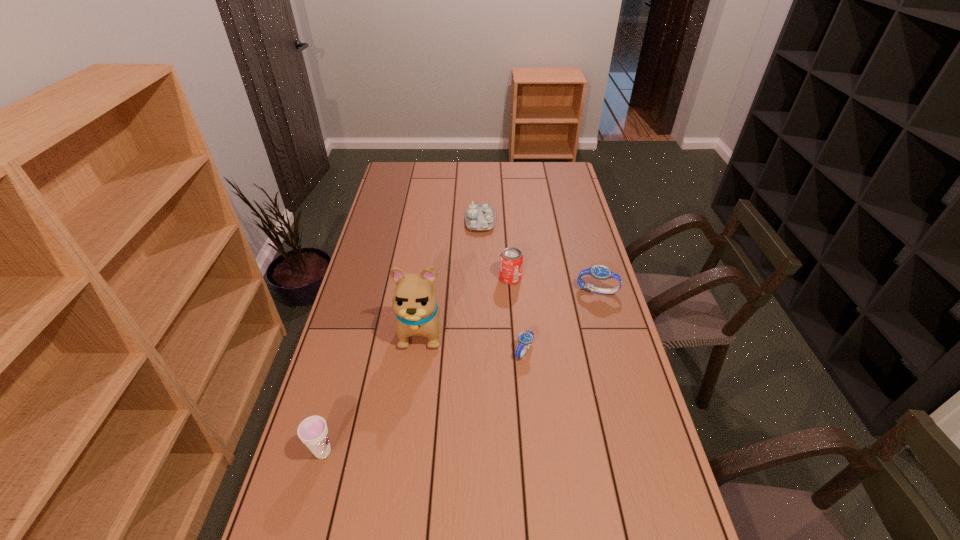
All watchs are currently evenly spaced. To continue this pattern, where would you add another watch on the left? Please point out a vacant spot. Please provide its 2D coordinates. Your answer should be formatted as a tuple, i.e. [(x, y)], where the tuple contains the x and y coordinates of a point satisfying the conditions above.

[(426, 431)]